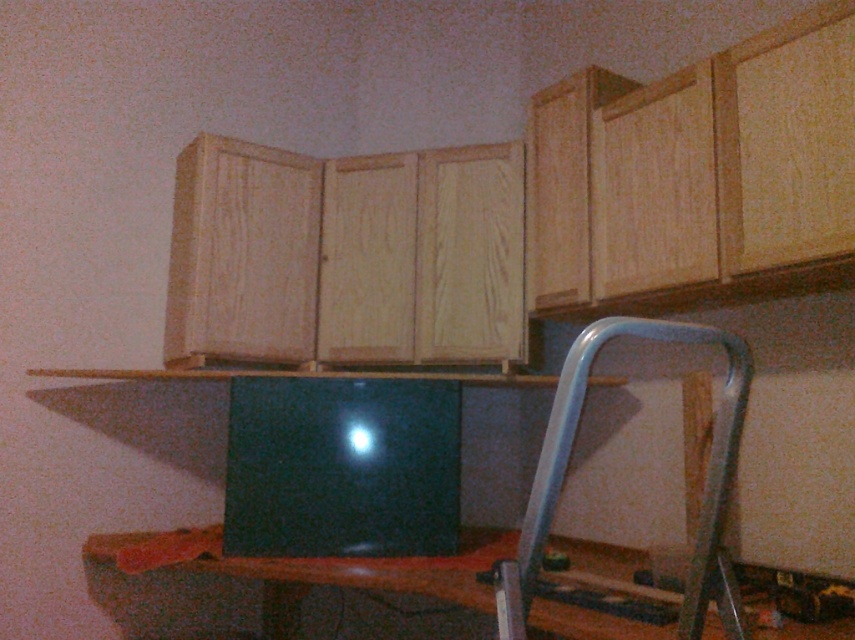
Does point (246, 442) come behind point (588, 358)?

Yes, point (246, 442) is farther from viewer.

Can you confirm if black glossy laptop at center is bigger than metallic silver chair at lower right?

Actually, black glossy laptop at center might be smaller than metallic silver chair at lower right.

Is point (299, 376) more distant than point (557, 499)?

Yes, point (299, 376) is farther from viewer.

This screenshot has height=640, width=855. Find the location of `black glossy laptop at center`. black glossy laptop at center is located at coordinates (342, 467).

Does point (594, 627) come farther from viewer compared to point (546, 497)?

Yes, point (594, 627) is behind point (546, 497).

Is wooden table at center in front of metallic silver chair at lower right?

No, wooden table at center is behind metallic silver chair at lower right.

Which is behind, point (714, 621) or point (721, 464)?

Point (714, 621)

Identify the location of wooden table at center. The width and height of the screenshot is (855, 640). (246, 588).

Can you confirm if black glossy laptop at center is thinner than wooden table at center?

Yes.

Can you confirm if black glossy laptop at center is positioned below wooden table at center?

Incorrect, black glossy laptop at center is not positioned below wooden table at center.

Between point (405, 397) and point (791, 637), which one is positioned in front?

Point (791, 637)

Image resolution: width=855 pixels, height=640 pixels. I want to click on black glossy laptop at center, so click(342, 467).